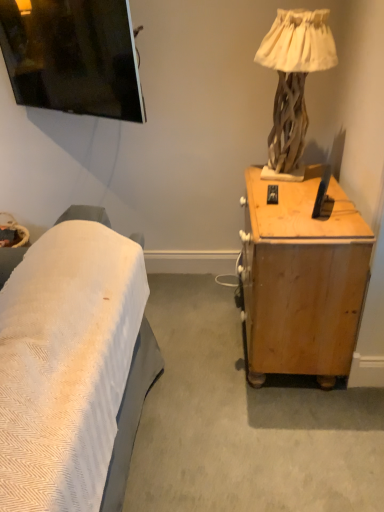
The image size is (384, 512). Identify the location of vacant area in front of wooden desk at right. (274, 438).